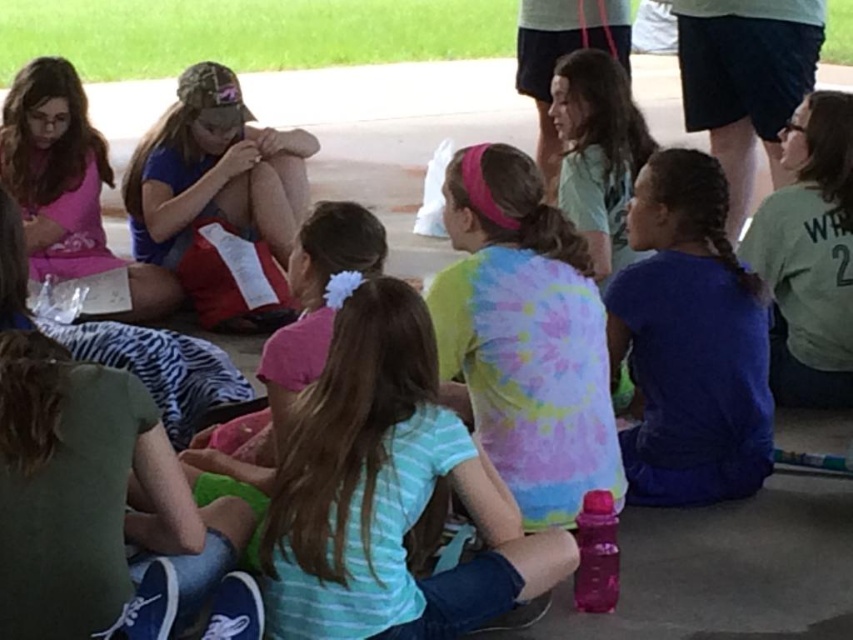
You are a photographer trying to capture a photo of the striped cotton shirt at center and the green jersey at right. Based on their positions, which one should you focus on first to ensure both are in the frame?

The striped cotton shirt at center is below the green jersey at right, so you should focus on the green jersey at right first to ensure both are in the frame.

You are a photographer trying to capture a candid shot of the children. You notice the green jersey at right and the matte pink shirt at upper left. Which child should you focus on to ensure the subject is taller in the frame?

The green jersey at right is taller than the matte pink shirt at upper left, so focusing on the child wearing the green jersey at right will ensure the subject is taller in the frame.

You are a photographer trying to capture a group photo of the children. You want to ensure that both the striped cotton shirt at center and the matte pink shirt at upper left are clearly visible. Given their sizes, which shirt might need to be positioned closer to the camera to ensure visibility?

The striped cotton shirt at center has a smaller size compared to matte pink shirt at upper left, so positioning the striped cotton shirt at center closer to the camera would help ensure its visibility alongside the larger matte pink shirt at upper left.